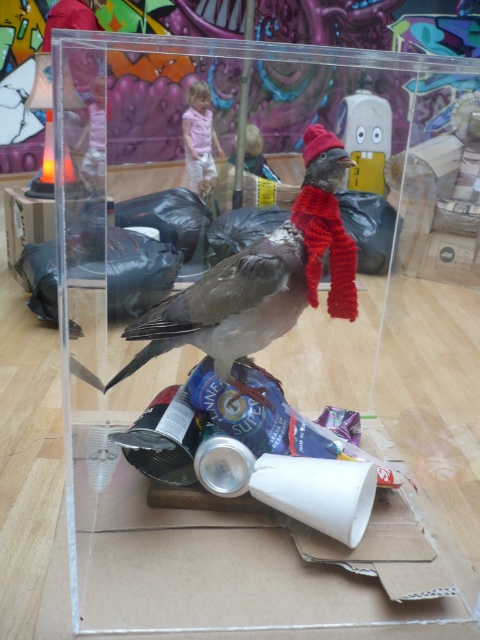
Question: In this image, where is matte gray bird at center located relative to rubber duck at center?

Choices:
 (A) right
 (B) left

Answer: (B)

Question: Which object is closer to the camera taking this photo?

Choices:
 (A) rubber duck at center
 (B) matte gray bird at center

Answer: (B)

Question: Does matte gray bird at center have a greater width compared to rubber duck at center?

Choices:
 (A) no
 (B) yes

Answer: (B)

Question: Can you confirm if matte gray bird at center is thinner than rubber duck at center?

Choices:
 (A) no
 (B) yes

Answer: (A)